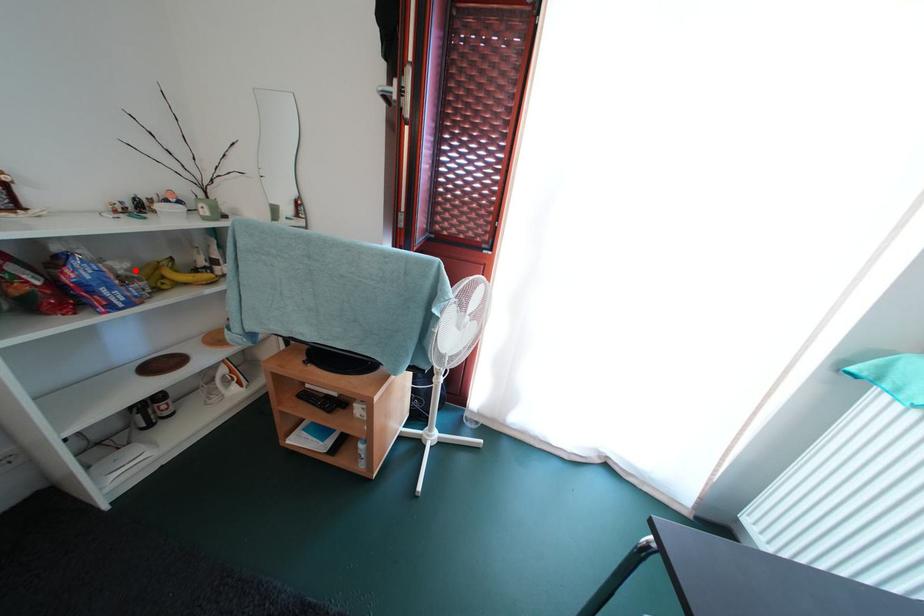
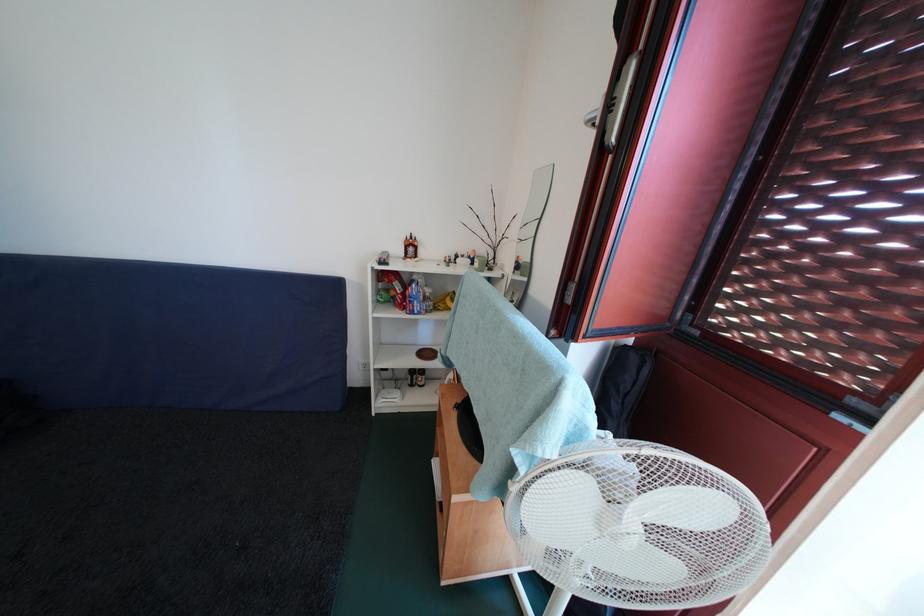
Find the pixel in the second image that matches the highlighted location in the first image.

(438, 296)